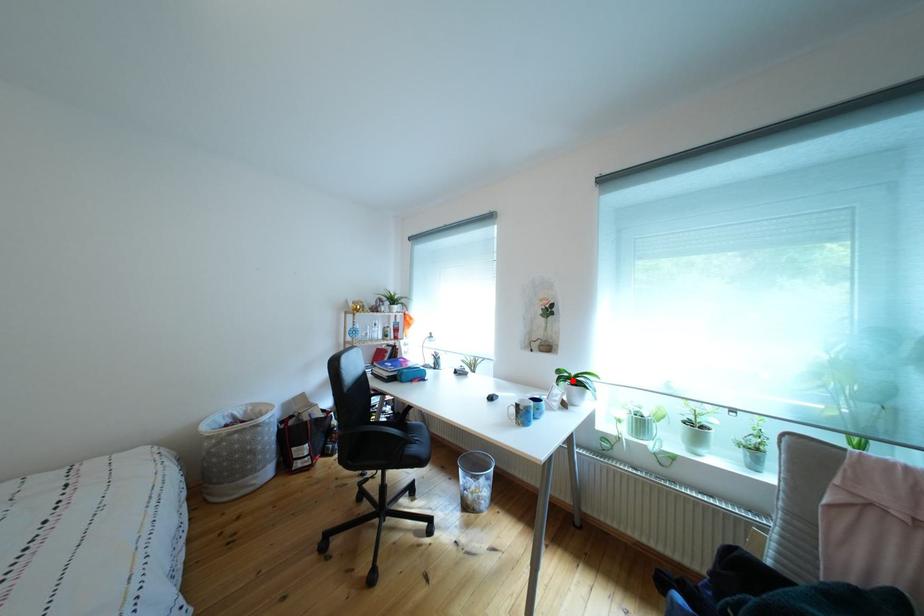
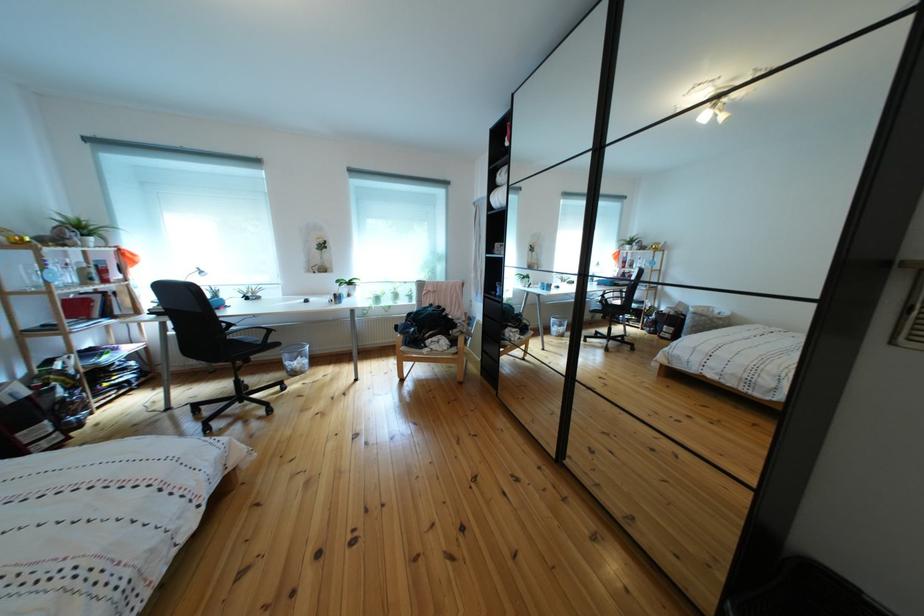
Find the pixel in the second image that matches the highlighted location in the first image.

(351, 288)